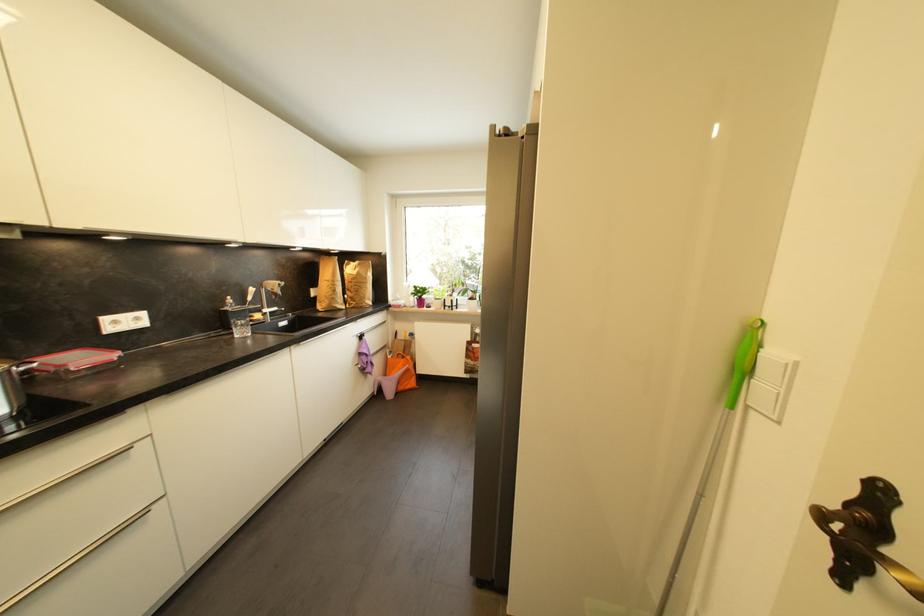
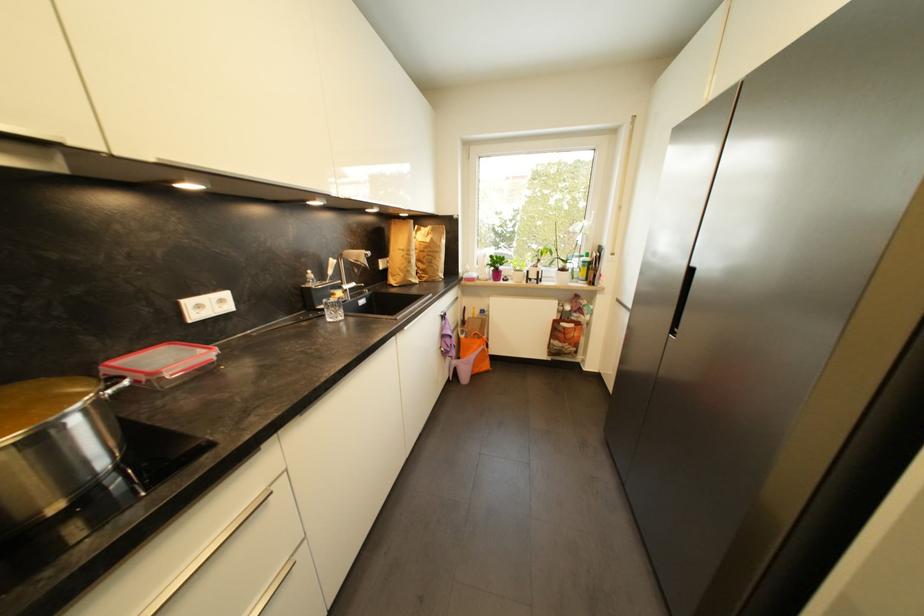
Find the pixel in the second image that matches the point at 142,321 in the first image.

(226, 302)